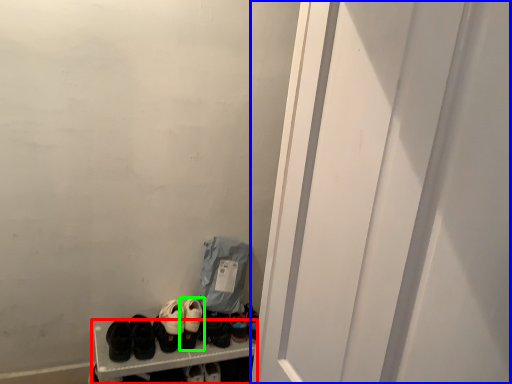
Question: Which is nearer to the bookshelf (highlighted by a red box)? screen door (highlighted by a blue box) or footwear (highlighted by a green box).

Choices:
 (A) screen door
 (B) footwear

Answer: (B)